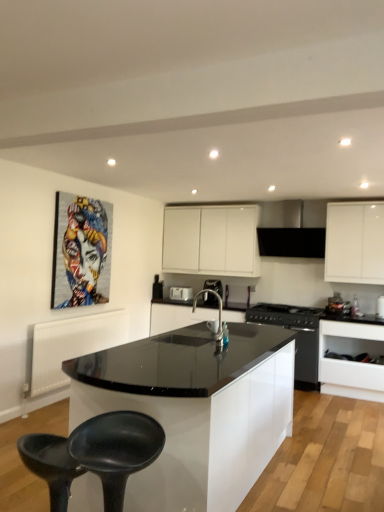
Question: Is satin nickel faucet at center inside the boundaries of satin silver coffee machine at center, or outside?

Choices:
 (A) inside
 (B) outside

Answer: (B)

Question: Considering the positions of satin nickel faucet at center and satin silver coffee machine at center in the image, is satin nickel faucet at center wider or thinner than satin silver coffee machine at center?

Choices:
 (A) thin
 (B) wide

Answer: (A)

Question: Which object is positioned closest to the white glossy toaster at center, which is the second appliance in front-to-back order?

Choices:
 (A) black glossy microwave at center, placed as the second appliance when sorted from back to front
 (B) satin silver coffee machine at center
 (C) black matte bar stool at lower left
 (D) white glossy cabinet at upper center, positioned as the third cabinetry in bottom-to-top order
 (E) black glossy stove at center, which is counted as the 1th kitchen appliance, starting from the bottom

Answer: (B)

Question: Which of these objects is positioned closest to the black glass stove at center?

Choices:
 (A) black matte bar stool at lower left
 (B) black glossy microwave at center, placed as the 2th appliance when sorted from left to right
 (C) black glossy countertop at center, the 2th cabinetry when ordered from top to bottom
 (D) white glossy drawer at lower right, the third cabinetry from the top
 (E) satin nickel faucet at center

Answer: (D)